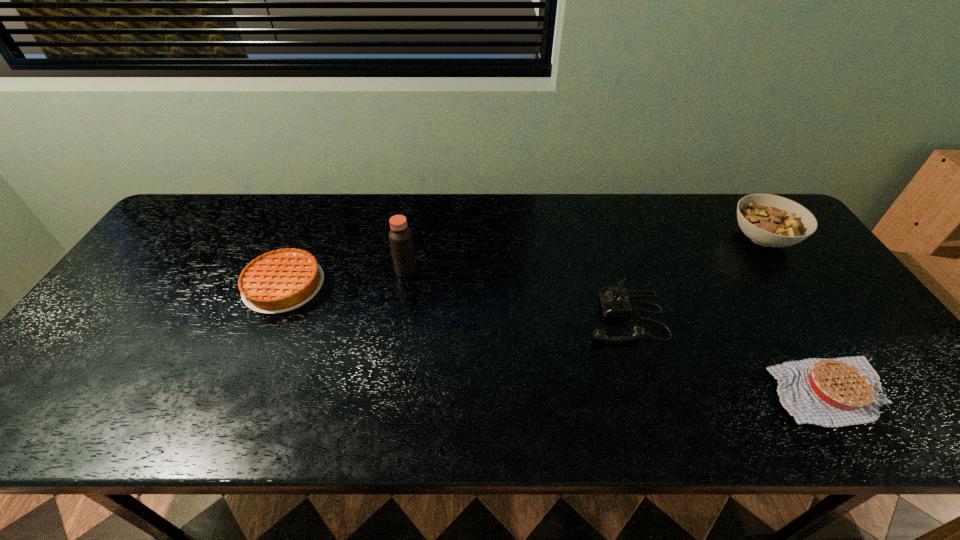
What are the coordinates of `object that is at the far right corner` in the screenshot? It's located at (769, 220).

Identify the location of object positioned at the near right corner. The width and height of the screenshot is (960, 540). (838, 392).

Find the location of a particular element. Image resolution: width=960 pixels, height=540 pixels. free spot at the far edge of the desktop is located at coordinates (691, 207).

In the image, there is a desktop. Where is `vacant space at the left edge`? The height and width of the screenshot is (540, 960). vacant space at the left edge is located at coordinates (140, 316).

Identify the location of vacant space at the right edge of the desktop. Image resolution: width=960 pixels, height=540 pixels. (780, 279).

Locate an element on the screen. free space that is in between the vinegar and the farther pie is located at coordinates (346, 278).

Image resolution: width=960 pixels, height=540 pixels. Identify the location of empty location between the nearer pie and the taller pie. (557, 339).

Locate an element on the screen. free area in between the second tallest object and the shorter pie is located at coordinates (796, 315).

The width and height of the screenshot is (960, 540). In order to click on vacant region between the farther pie and the shorter pie in this screenshot , I will do `click(557, 339)`.

You are a GUI agent. You are given a task and a screenshot of the screen. Output one action in this format:
    pyautogui.click(x=<x>, y=<y>)
    Task: Click on the free space between the telephone and the vinegar
    The width and height of the screenshot is (960, 540).
    Given the screenshot: What is the action you would take?
    pyautogui.click(x=516, y=293)